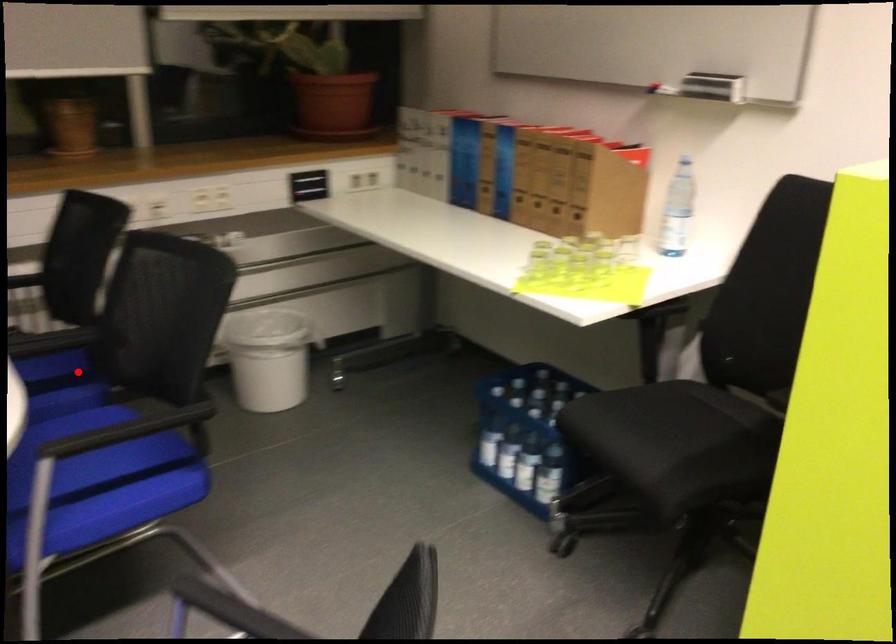
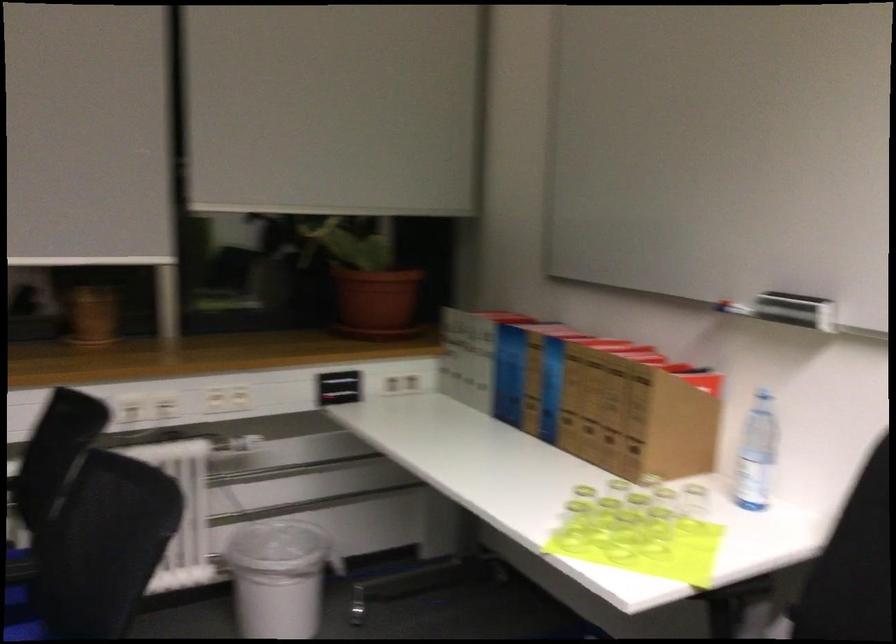
Question: I am providing you with two images of the same scene from different viewpoints. In image1, a red point is highlighted. Considering the same 3D point in image2, which of the following is correct?

Choices:
 (A) It is closer
 (B) It is farther

Answer: (A)